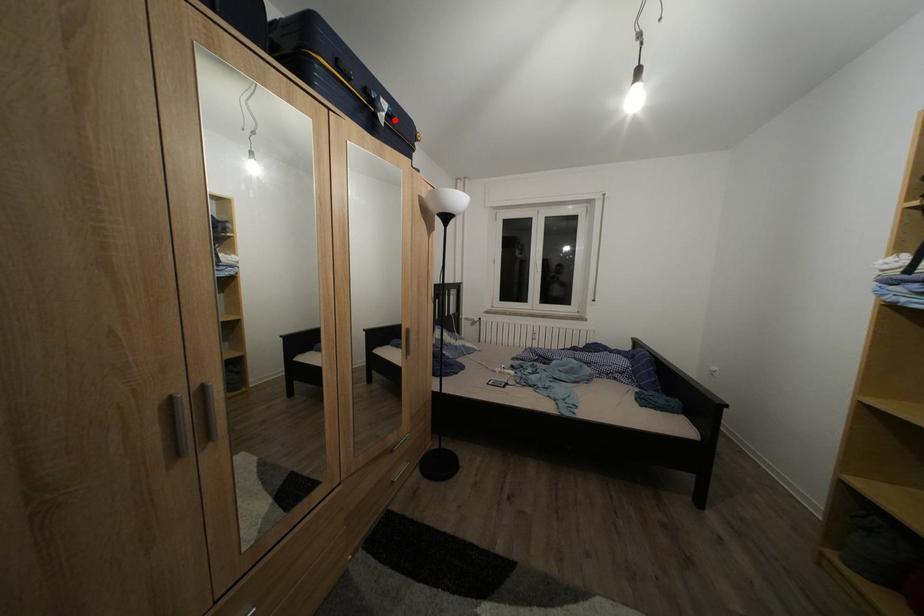
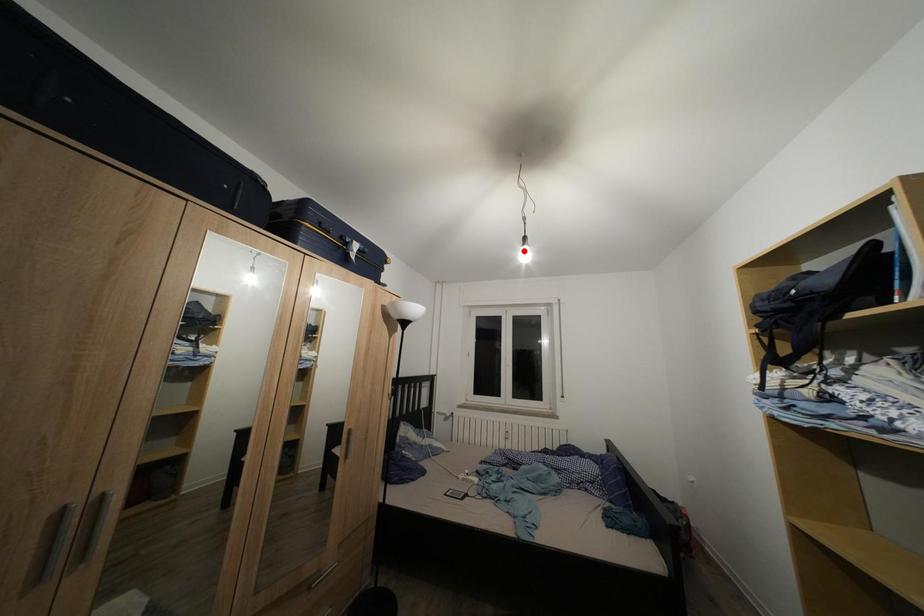
From the picture: I am providing you with two images of the same scene from different viewpoints. A red point is marked on the first image and another point is marked on the second image. Is the marked point in image1 the same physical position as the marked point in image2?

No